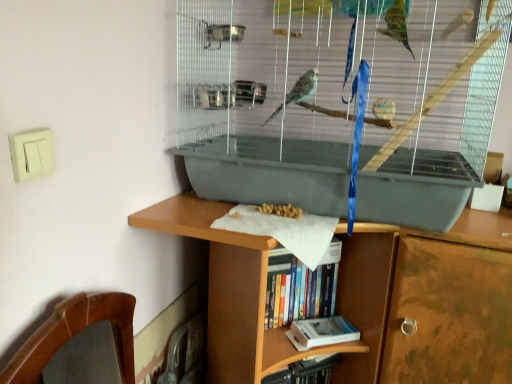
Question: Considering the relative sizes of hardcover book at lower center, the first book when ordered from bottom to top, and hardcover book at center, the second book positioned from the bottom, in the image provided, is hardcover book at lower center, the first book when ordered from bottom to top, taller than hardcover book at center, the second book positioned from the bottom,?

Choices:
 (A) no
 (B) yes

Answer: (A)

Question: Is hardcover book at lower center, positioned as the 2th book in top-to-bottom order, thinner than hardcover book at center, which is counted as the 1th book, starting from the top?

Choices:
 (A) yes
 (B) no

Answer: (A)

Question: Is hardcover book at lower center, positioned as the 2th book in top-to-bottom order, positioned far away from hardcover book at center, which is counted as the 1th book, starting from the top?

Choices:
 (A) no
 (B) yes

Answer: (A)

Question: Does hardcover book at lower center, the first book when ordered from bottom to top, have a smaller size compared to hardcover book at center, which is counted as the 1th book, starting from the top?

Choices:
 (A) yes
 (B) no

Answer: (A)

Question: Considering the relative sizes of hardcover book at lower center, the first book when ordered from bottom to top, and hardcover book at center, the second book positioned from the bottom, in the image provided, is hardcover book at lower center, the first book when ordered from bottom to top, wider than hardcover book at center, the second book positioned from the bottom,?

Choices:
 (A) no
 (B) yes

Answer: (A)

Question: In the image, is gray plastic birdcage at center positioned in front of or behind hardcover book at center, the second book positioned from the bottom?

Choices:
 (A) behind
 (B) front

Answer: (B)

Question: Looking at their shapes, would you say gray plastic birdcage at center is wider or thinner than hardcover book at center, which is counted as the 1th book, starting from the top?

Choices:
 (A) thin
 (B) wide

Answer: (B)

Question: Considering the positions of gray plastic birdcage at center and hardcover book at center, the second book positioned from the bottom, in the image, is gray plastic birdcage at center taller or shorter than hardcover book at center, the second book positioned from the bottom,?

Choices:
 (A) tall
 (B) short

Answer: (A)

Question: From a real-world perspective, is gray plastic birdcage at center above or below hardcover book at center, which is counted as the 1th book, starting from the top?

Choices:
 (A) above
 (B) below

Answer: (A)

Question: From the image's perspective, is gray plastic birdcage at center located above or below hardcover book at lower center, the first book when ordered from bottom to top?

Choices:
 (A) below
 (B) above

Answer: (B)

Question: Does point (460, 105) appear closer or farther from the camera than point (350, 339)?

Choices:
 (A) farther
 (B) closer

Answer: (B)

Question: Is gray plastic birdcage at center taller or shorter than hardcover book at lower center, the first book when ordered from bottom to top?

Choices:
 (A) tall
 (B) short

Answer: (A)

Question: Considering the relative positions of gray plastic birdcage at center and hardcover book at lower center, the first book when ordered from bottom to top, in the image provided, is gray plastic birdcage at center to the left or to the right of hardcover book at lower center, the first book when ordered from bottom to top,?

Choices:
 (A) right
 (B) left

Answer: (A)

Question: Relative to gray plastic birdcage at center, is hardcover book at lower center, positioned as the 2th book in top-to-bottom order, in front or behind?

Choices:
 (A) behind
 (B) front

Answer: (A)

Question: Is hardcover book at lower center, positioned as the 2th book in top-to-bottom order, wider or thinner than gray plastic birdcage at center?

Choices:
 (A) wide
 (B) thin

Answer: (B)